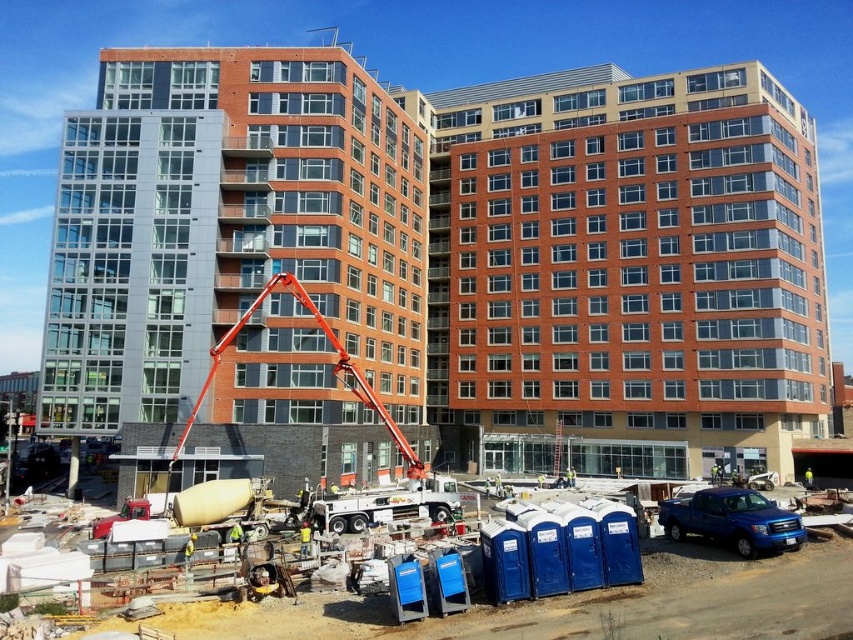
You are a delivery driver arriving at the construction site. You need to park your vehicle near the shiny blue truck at lower right but also want to stay clear of the matte glass building at center. Based on the scene, which direction should you drive to avoid the building?

The matte glass building at center is positioned on the left side of the shiny blue truck at lower right, so to avoid it, you should drive to the right side of the shiny blue truck at lower right.